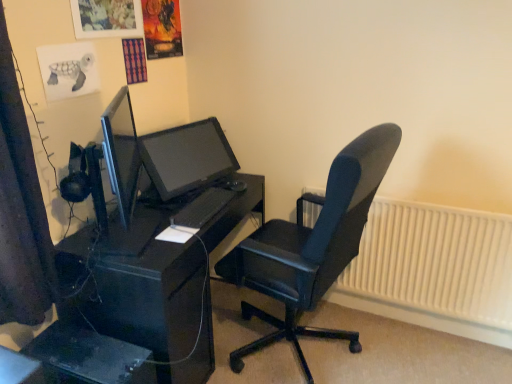
Locate an element on the screen. vacant space in front of white plastic radiator at right is located at coordinates (407, 350).